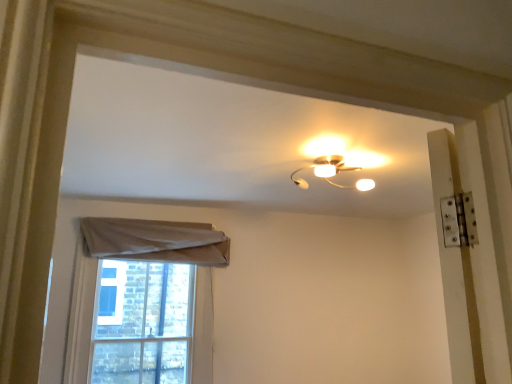
Where is `light beige fabric at lower left`? light beige fabric at lower left is located at coordinates (143, 301).

What do you see at coordinates (143, 301) in the screenshot? I see `light beige fabric at lower left` at bounding box center [143, 301].

Locate an element on the screen. Image resolution: width=512 pixels, height=384 pixels. matte white lamp at upper center is located at coordinates pos(330,164).

What do you see at coordinates (330, 164) in the screenshot?
I see `matte white lamp at upper center` at bounding box center [330, 164].

What are the coordinates of `light beige fabric at lower left` in the screenshot? It's located at (143, 301).

Considering the positions of objects light beige fabric at lower left and matte white lamp at upper center in the image provided, who is more to the right, light beige fabric at lower left or matte white lamp at upper center?

Positioned to the right is matte white lamp at upper center.

Between light beige fabric at lower left and matte white lamp at upper center, which one is positioned behind?

light beige fabric at lower left is behind.

Which is more distant, (119, 315) or (337, 138)?

Positioned behind is point (119, 315).

Looking at this image, from the image's perspective, relative to matte white lamp at upper center, is light beige fabric at lower left above or below?

From the image's perspective, light beige fabric at lower left appears below matte white lamp at upper center.

From a real-world perspective, is light beige fabric at lower left physically located above or below matte white lamp at upper center?

In terms of real-world spatial position, light beige fabric at lower left is below matte white lamp at upper center.

Is light beige fabric at lower left wider or thinner than matte white lamp at upper center?

Considering their sizes, light beige fabric at lower left looks slimmer than matte white lamp at upper center.

Who is shorter, light beige fabric at lower left or matte white lamp at upper center?

With less height is matte white lamp at upper center.

Does light beige fabric at lower left have a larger size compared to matte white lamp at upper center?

Yes.

Is light beige fabric at lower left surrounding matte white lamp at upper center?

No, light beige fabric at lower left does not contain matte white lamp at upper center.

Is there a large distance between light beige fabric at lower left and matte white lamp at upper center?

Absolutely, light beige fabric at lower left is distant from matte white lamp at upper center.

Could you tell me if light beige fabric at lower left is facing matte white lamp at upper center?

Yes, light beige fabric at lower left is facing matte white lamp at upper center.

How many degrees apart are the facing directions of light beige fabric at lower left and matte white lamp at upper center?

0.794 degrees.

You are a GUI agent. You are given a task and a screenshot of the screen. Output one action in this format:
    pyautogui.click(x=<x>, y=<y>)
    Task: Click on the window that appears on the left of matte white lamp at upper center
    
    Given the screenshot: What is the action you would take?
    pyautogui.click(x=143, y=301)

From the picture: Which is more to the right, matte white lamp at upper center or light beige fabric at lower left?

Positioned to the right is matte white lamp at upper center.

Considering their positions, is matte white lamp at upper center located in front of or behind light beige fabric at lower left?

matte white lamp at upper center is positioned closer to the viewer than light beige fabric at lower left.

Between point (339, 149) and point (181, 348), which one is positioned in front?

The point (339, 149) is closer to the camera.

From the image's perspective, who appears lower, matte white lamp at upper center or light beige fabric at lower left?

light beige fabric at lower left is shown below in the image.

From a real-world perspective, between matte white lamp at upper center and light beige fabric at lower left, who is vertically higher?

In real-world perspective, matte white lamp at upper center is above.

Which of these two, matte white lamp at upper center or light beige fabric at lower left, is thinner?

light beige fabric at lower left.

Considering the relative sizes of matte white lamp at upper center and light beige fabric at lower left in the image provided, is matte white lamp at upper center shorter than light beige fabric at lower left?

Indeed, matte white lamp at upper center has a lesser height compared to light beige fabric at lower left.

Is matte white lamp at upper center bigger or smaller than light beige fabric at lower left?

Considering their sizes, matte white lamp at upper center takes up less space than light beige fabric at lower left.

Is light beige fabric at lower left surrounded by matte white lamp at upper center?

Actually, light beige fabric at lower left is outside matte white lamp at upper center.

Can you see matte white lamp at upper center touching light beige fabric at lower left?

They are not placed beside each other.

Is matte white lamp at upper center facing away from light beige fabric at lower left?

No, matte white lamp at upper center is not facing the opposite direction of light beige fabric at lower left.

How distant is matte white lamp at upper center from light beige fabric at lower left?

matte white lamp at upper center is 1.34 meters from light beige fabric at lower left.

The width and height of the screenshot is (512, 384). Find the location of `lamp located above the light beige fabric at lower left (from the image's perspective)`. lamp located above the light beige fabric at lower left (from the image's perspective) is located at coordinates (330, 164).

In order to click on window below the matte white lamp at upper center (from a real-world perspective) in this screenshot , I will do `click(143, 301)`.

Where is `lamp in front of the light beige fabric at lower left`? Image resolution: width=512 pixels, height=384 pixels. lamp in front of the light beige fabric at lower left is located at coordinates (330, 164).